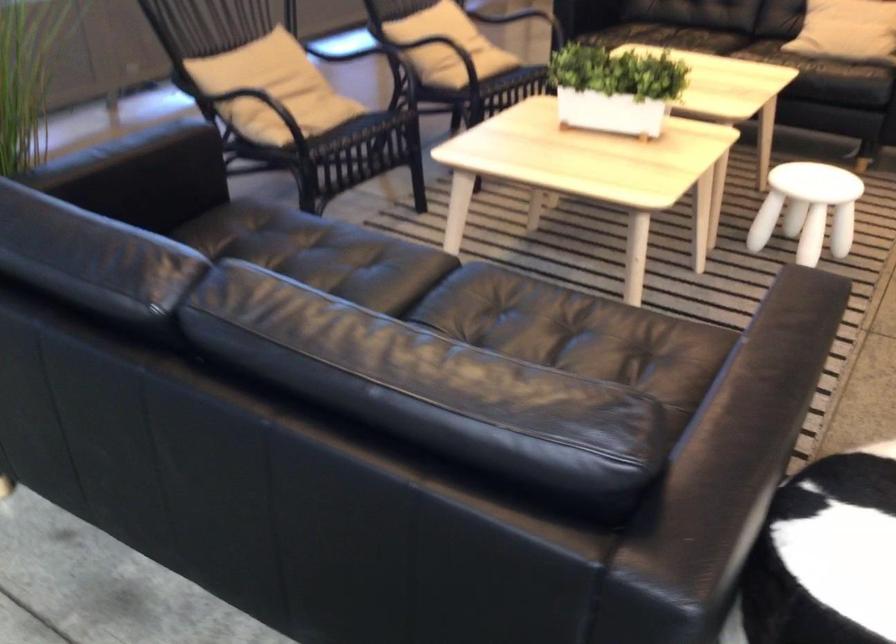
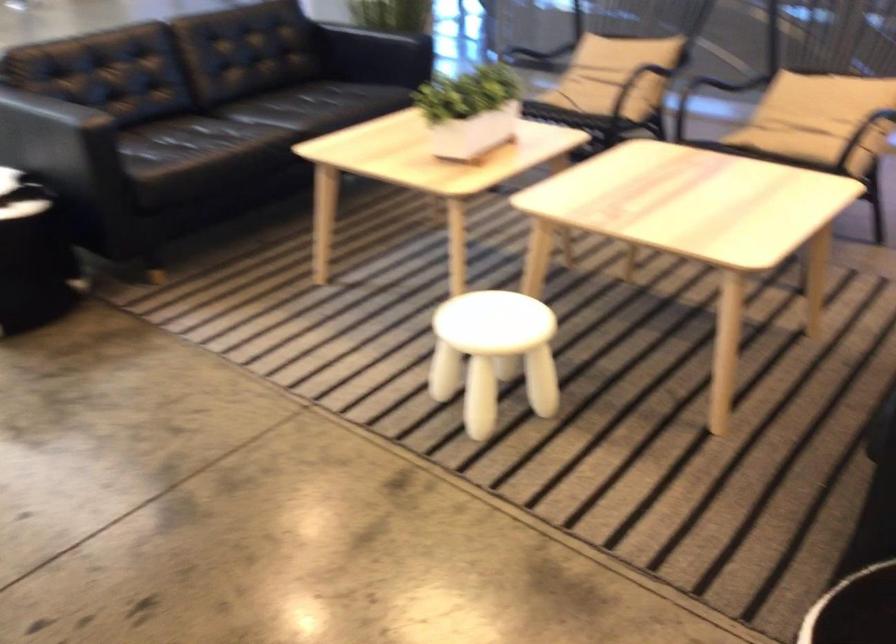
Find the pixel in the second image that matches point 634,80 in the first image.

(470, 111)